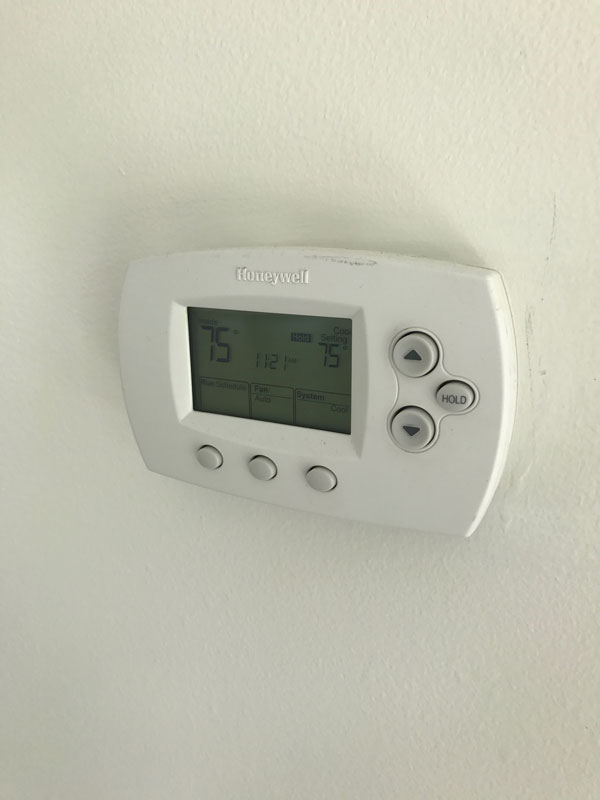
The image size is (600, 800). Find the location of `lcd display`. lcd display is located at coordinates (244, 369).